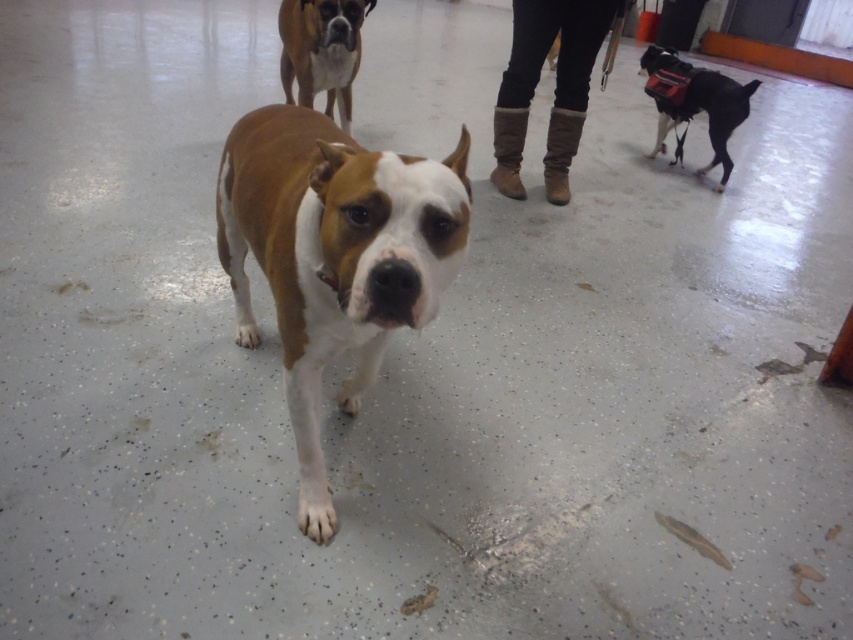
Which of these two, brown matte dog at upper center or black leather dog at right, stands taller?

With more height is black leather dog at right.

Is brown matte dog at upper center in front of black leather dog at right?

Yes, brown matte dog at upper center is closer to the viewer.

Is point (296, 81) positioned before point (643, 88)?

Yes.

You are a GUI agent. You are given a task and a screenshot of the screen. Output one action in this format:
    pyautogui.click(x=<x>, y=<y>)
    Task: Click on the brown matte dog at upper center
    Image resolution: width=853 pixels, height=640 pixels.
    Given the screenshot: What is the action you would take?
    pyautogui.click(x=321, y=51)

Does brown/white fur dog at center have a greater height compared to black leather dog at right?

Indeed, brown/white fur dog at center has a greater height compared to black leather dog at right.

Does brown/white fur dog at center appear under black leather dog at right?

Yes, brown/white fur dog at center is below black leather dog at right.

At what (x,y) coordinates should I click in order to perform the action: click on brown/white fur dog at center. Please return your answer as a coordinate pair (x, y). Looking at the image, I should click on (334, 257).

Does brown/white fur dog at center have a greater height compared to brown matte dog at upper center?

Yes.

Is brown/white fur dog at center shorter than brown matte dog at upper center?

Incorrect, brown/white fur dog at center's height does not fall short of brown matte dog at upper center's.

Is point (254, 156) closer to viewer compared to point (340, 88)?

Yes, it is.

Locate an element on the screen. This screenshot has height=640, width=853. brown/white fur dog at center is located at coordinates (334, 257).